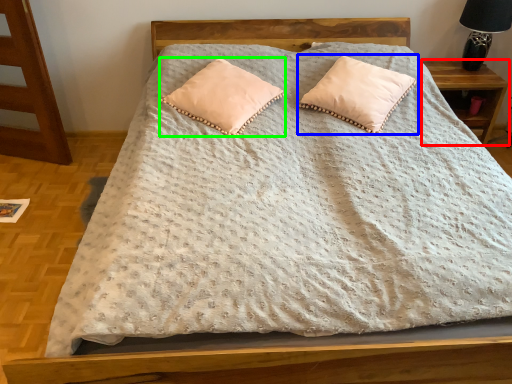
Question: Which object is the farthest from nightstand (highlighted by a red box)? Choose among these: pillow (highlighted by a blue box) or pillow (highlighted by a green box).

Choices:
 (A) pillow
 (B) pillow

Answer: (B)